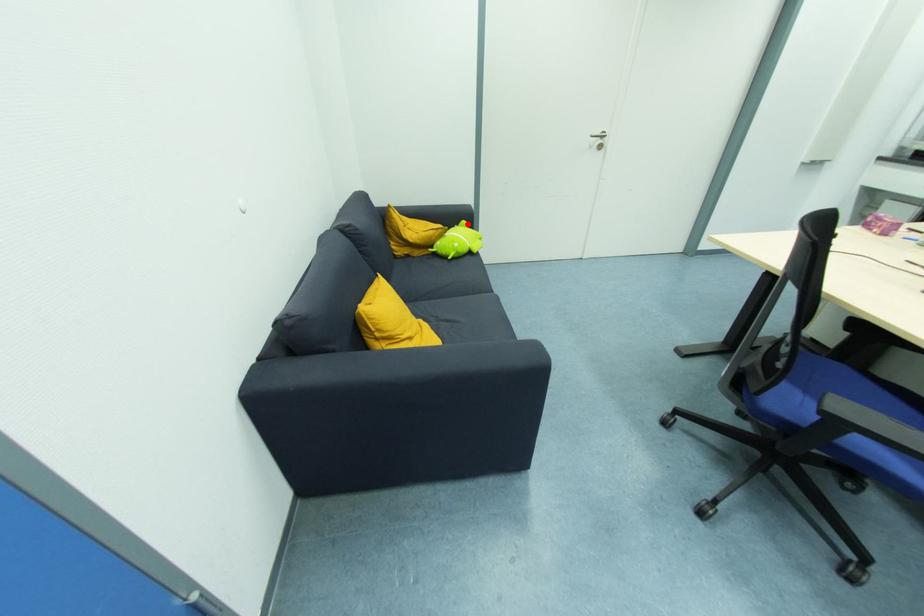
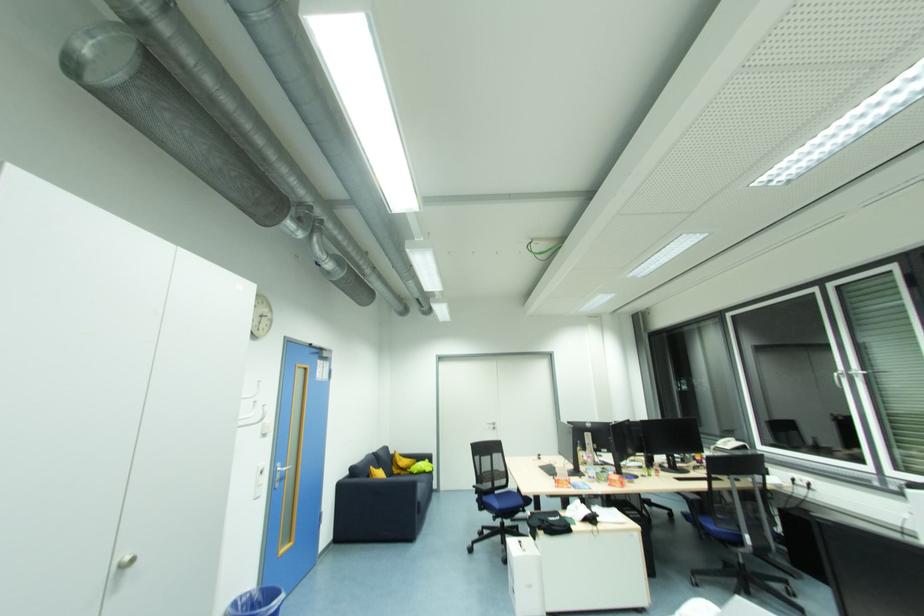
Find the pixel in the second image that matches the highlighted location in the first image.

(430, 461)